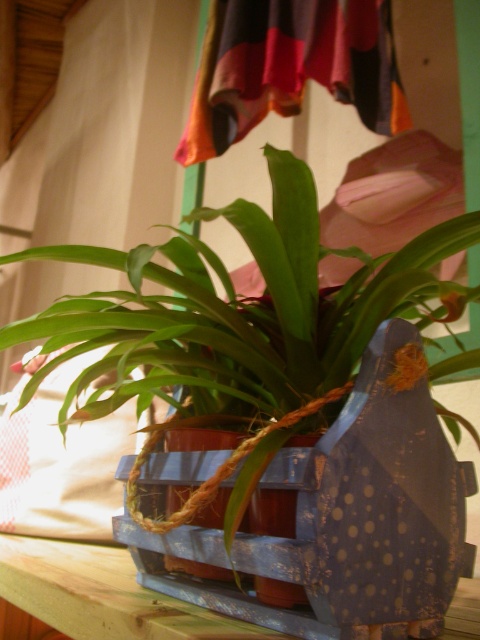
Based on the scene description, where is the green matte plant at center located in terms of its 2D coordinates?

The green matte plant at center is located at the 2D coordinates of point (240, 330).

You are designing a shelf display and need to know the relative sizes of the items. Which object has a smaller width between the green matte plant at center and the wooden at lower left?

The green matte plant at center is thinner than the wooden at lower left, so the green matte plant at center has a smaller width.

You are standing in front of the plant arrangement and want to place a small decoration. You have two options to place it at the coordinates point [196,253] and point [44,614]. Which coordinate is closer to you?

Point [196,253] is closer to the viewer than point [44,614], so you should place the decoration there if you want it closer.